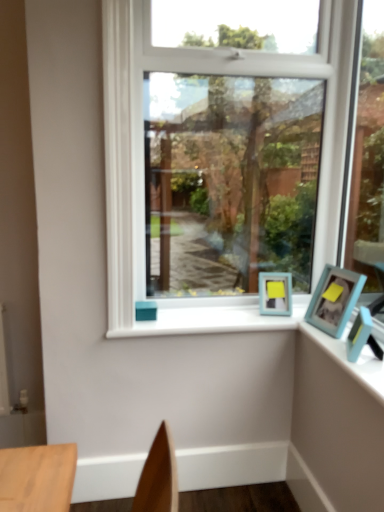
This screenshot has height=512, width=384. In order to click on free point above white painted wood at center (from a real-world perspective) in this screenshot , I will do `click(219, 311)`.